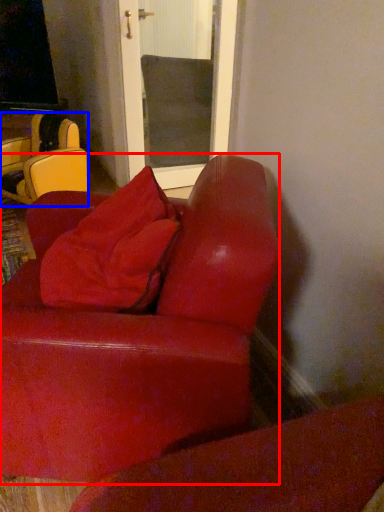
Question: Which of the following is the closest to the observer, studio couch (highlighted by a red box) or chair (highlighted by a blue box)?

Choices:
 (A) studio couch
 (B) chair

Answer: (A)